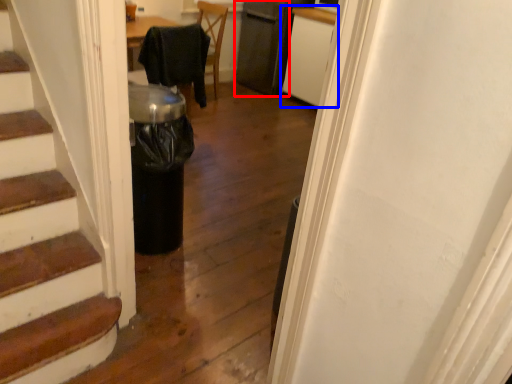
Question: Which point is closer to the camera, appliance (highlighted by a red box) or cabinetry (highlighted by a blue box)?

Choices:
 (A) appliance
 (B) cabinetry

Answer: (B)